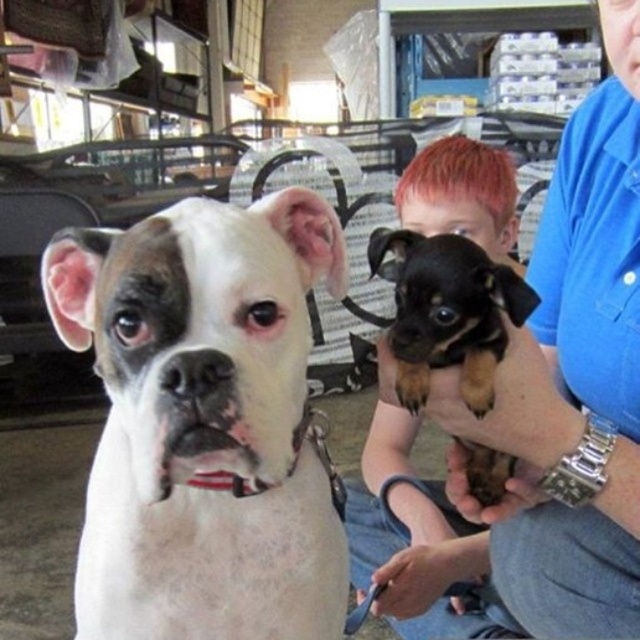
Question: Among these points, which one is nearest to the camera?

Choices:
 (A) (388, 346)
 (B) (376, 458)

Answer: (A)

Question: Is smooth blue shirt at upper right to the right of black and tan fur puppy at center from the viewer's perspective?

Choices:
 (A) no
 (B) yes

Answer: (B)

Question: Which object appears closest to the camera in this image?

Choices:
 (A) black and tan fur puppy at center
 (B) smooth blue shirt at upper right
 (C) smooth black fur at center
 (D) white fur dog at left

Answer: (D)

Question: From the image, what is the correct spatial relationship of smooth black fur at center in relation to black and tan fur puppy at center?

Choices:
 (A) left
 (B) right

Answer: (B)

Question: Estimate the real-world distances between objects in this image. Which object is closer to the smooth black fur at center?

Choices:
 (A) smooth blue shirt at upper right
 (B) white fur dog at left

Answer: (A)

Question: Is smooth black fur at center thinner than black and tan fur puppy at center?

Choices:
 (A) no
 (B) yes

Answer: (A)